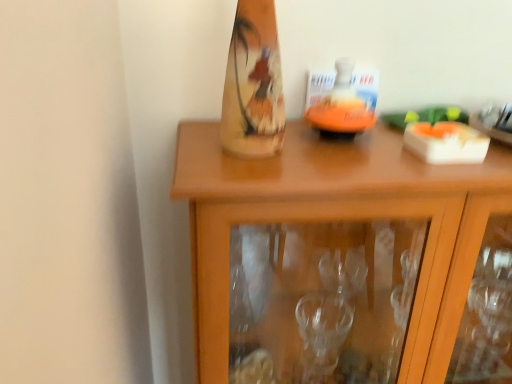
Locate an element on the screen. This screenshot has width=512, height=384. free space to the left of orange matte candle holder at center is located at coordinates (258, 154).